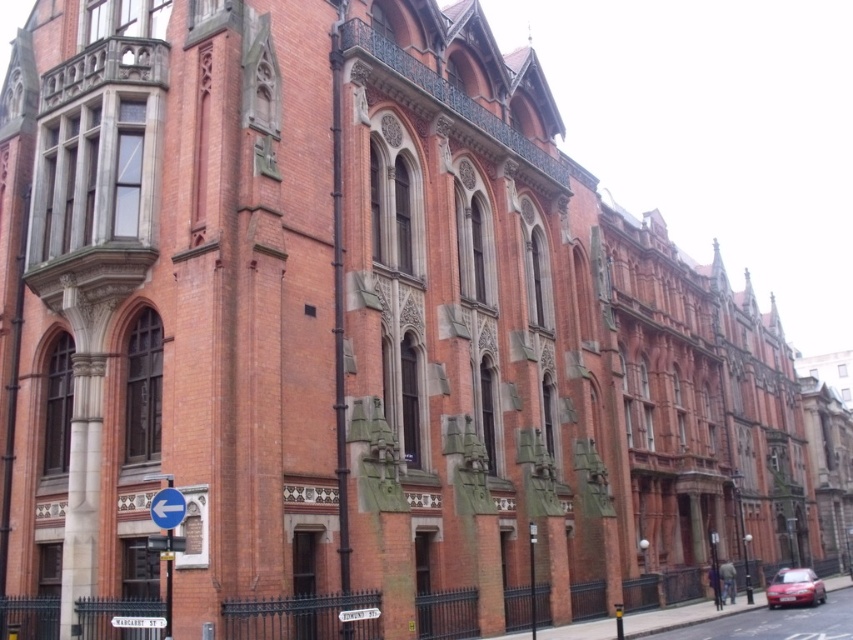
You are a delivery driver who needs to park your shiny red car at lower right as close as possible to the blue plastic arrow at lower left. The parking space must be within 50 meters. Can you park your car within the required distance?

The shiny red car at lower right is 60.39 meters away from the blue plastic arrow at lower left, so it exceeds the 50 meters requirement. You cannot park within the required distance.

You are standing in front of the grand historic building and notice a shiny red car at lower right and a blue plastic arrow at lower left. Which object is positioned lower on the image?

The shiny red car at lower right is located below the blue plastic arrow at lower left, so it is positioned lower on the image.